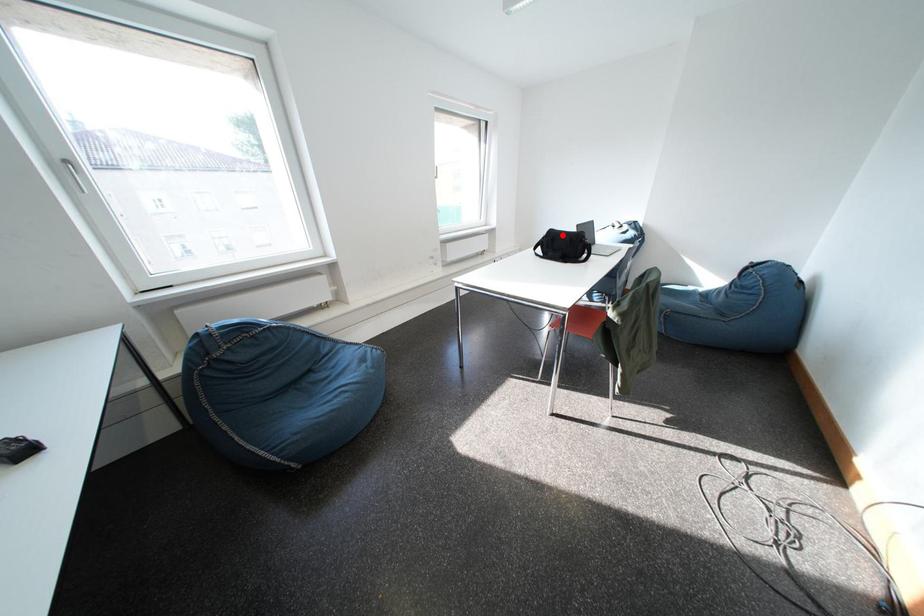
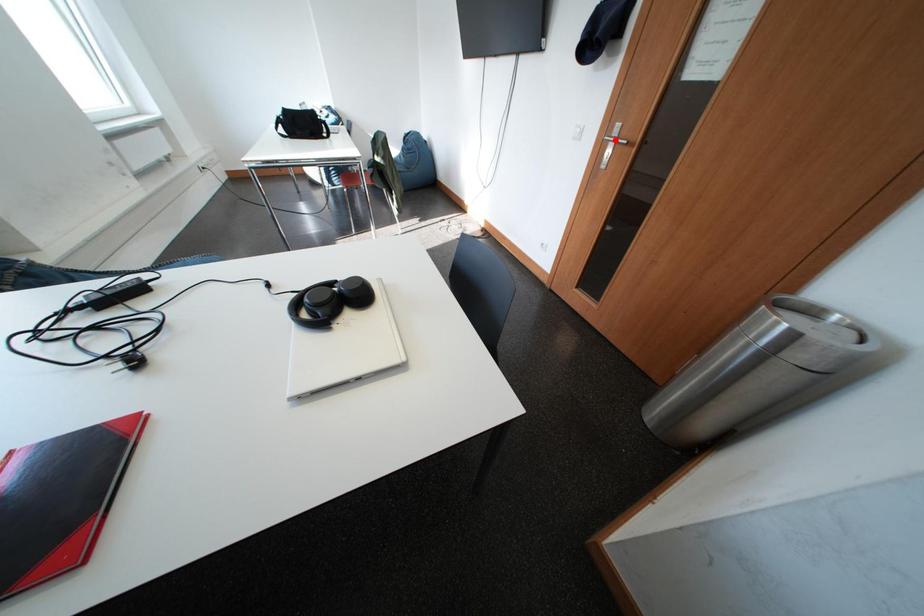
I am providing you with two images of the same scene from different viewpoints. A red point is marked on the first image and another point is marked on the second image. Is the marked point in image1 the same physical position as the marked point in image2?

No